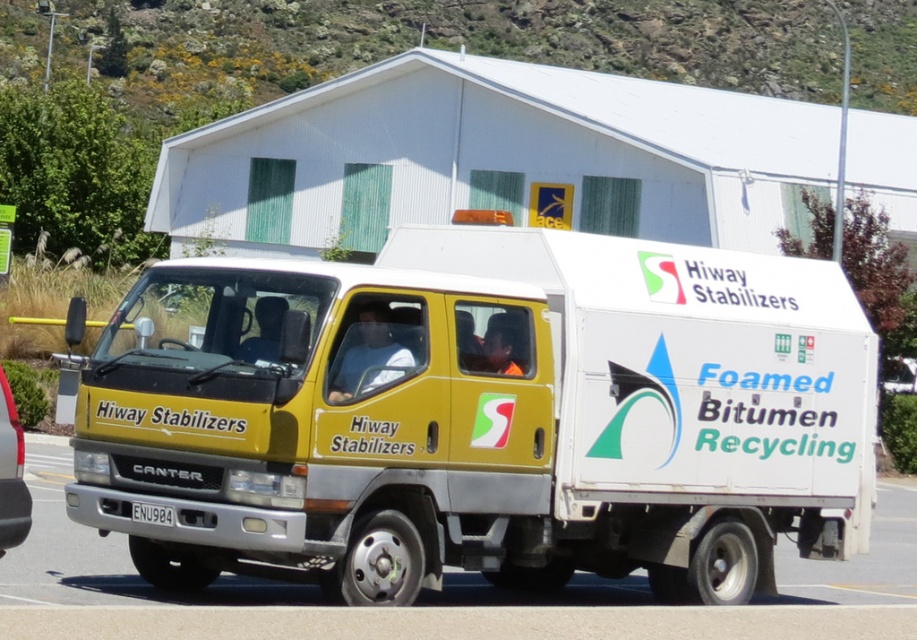
Which of these two, yellow matte truck at center or matte yellow truck at center, stands shorter?

matte yellow truck at center

Between yellow matte truck at center and matte yellow truck at center, which one has more height?

With more height is yellow matte truck at center.

Which is behind, point (431, 276) or point (4, 436)?

The point (431, 276) is behind.

You are a GUI agent. You are given a task and a screenshot of the screen. Output one action in this format:
    pyautogui.click(x=<x>, y=<y>)
    Task: Click on the yellow matte truck at center
    
    Given the screenshot: What is the action you would take?
    pyautogui.click(x=484, y=417)

Measure the distance between matte yellow truck at center and white plastic license plate at center.

1.07 meters

Does point (25, 516) come farther from viewer compared to point (149, 515)?

No, (25, 516) is closer to viewer.

Identify the location of matte yellow truck at center. The image size is (917, 640). (10, 474).

Is point (866, 400) positioned in front of point (166, 508)?

No.

Is point (212, 552) positioned after point (142, 506)?

Yes, it is behind point (142, 506).

The image size is (917, 640). Find the location of `yellow matte truck at center`. yellow matte truck at center is located at coordinates (484, 417).